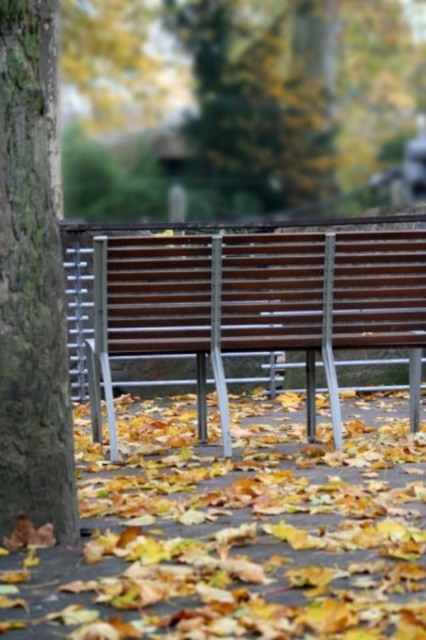
Consider the image. You are standing in front of the autumn scene with the wooden bench and fallen leaves. You notice two points marked in the image, point 1 at coordinates point [340,230] and point 2 at coordinates point [26,45]. Which point is closer to you?

Point [340,230] is further to the camera than point [26,45], so point [26,45] is closer to you.

You are a gardener who needs to clear the area around the yellow leaf litter at lower center and the smooth bark tree at left. Which object requires more physical effort to move due to its height?

→ The smooth bark tree at left requires more physical effort to move because it is taller than the yellow leaf litter at lower center.

You are an artist sketching the autumn scene. You need to decide which object to draw first based on their sizes. Which one should you start with, the yellow leaf litter at lower center or the wooden bench at center?

The wooden bench at center is larger than the yellow leaf litter at lower center, so you should start with the wooden bench at center to establish the main structure before adding smaller details.